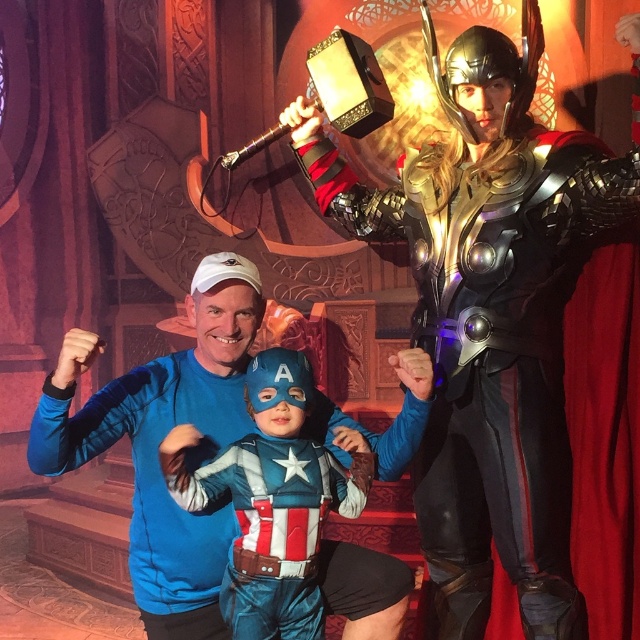
You are a photographer at the event and want to ensure that both the blue fabric shirt at center and the velvet blue costume at center are clearly visible in your photo. Which object should you focus on first to ensure depth of field captures both?

You should focus on the blue fabric shirt at center first since it is closer to the viewer than the velvet blue costume at center. By focusing on the closer object, the velvet blue costume at center will be in the background and still within the depth of field range.

You are a photographer setting up for a group photo. You notice the blue fabric shirt at center and the velvet blue costume at center. Which one is positioned higher in the image?

The blue fabric shirt at center is above the velvet blue costume at center, so the blue fabric shirt at center is positioned higher in the image.